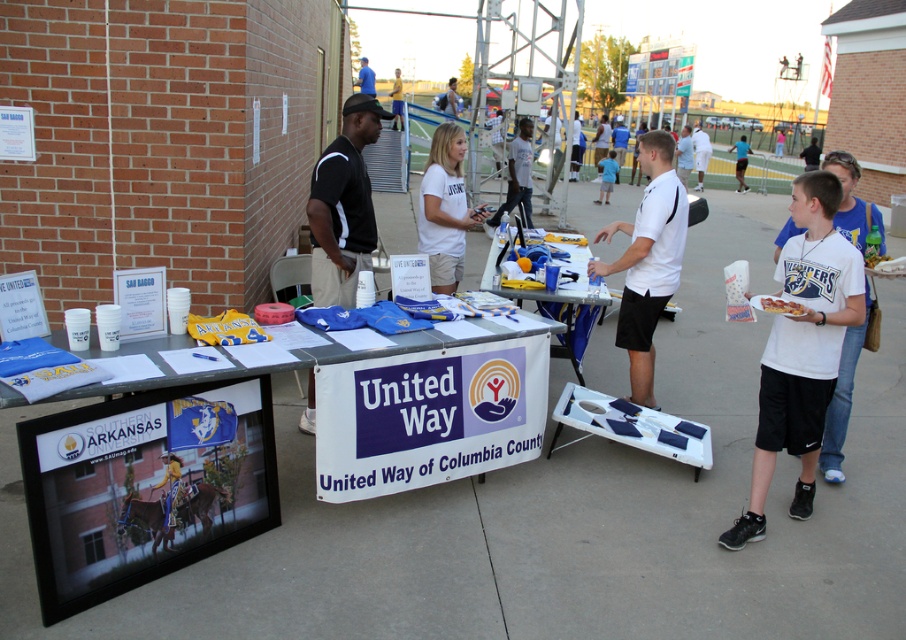
Between white cotton shirt at center and yellow shirt at center, which one appears on the left side from the viewer's perspective?

Result: yellow shirt at center

Which of these two, white cotton shirt at center or yellow shirt at center, stands shorter?

Standing shorter between the two is white cotton shirt at center.

Does point (447, 225) lie behind point (397, 83)?

No, it is in front of (397, 83).

Locate an element on the screen. white cotton shirt at center is located at coordinates (445, 209).

Who is shorter, white matte shirt at center or yellow shirt at center?

white matte shirt at center

Who is lower down, white matte shirt at center or yellow shirt at center?

white matte shirt at center is below.

This screenshot has height=640, width=906. What are the coordinates of `white matte shirt at center` in the screenshot? It's located at (647, 259).

Identify the location of white matte shirt at center. (647, 259).

Between blue athletic uniform at center and white paper cupcake at lower right, which one has more height?

Standing taller between the two is blue athletic uniform at center.

Does blue athletic uniform at center lie in front of white paper cupcake at lower right?

No, it is not.

Is point (741, 184) positioned after point (777, 307)?

Yes, point (741, 184) is farther from viewer.

Identify the location of blue athletic uniform at center. (740, 163).